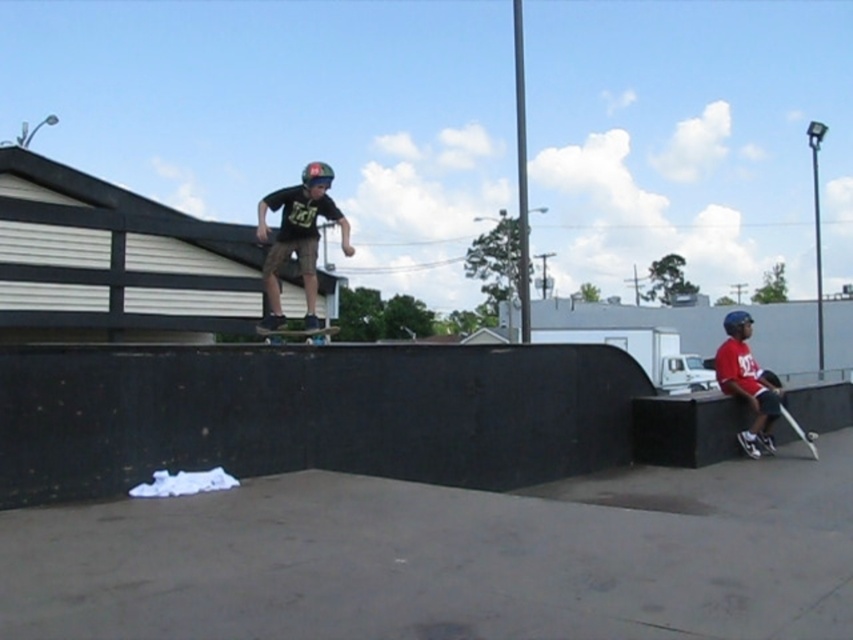
You are a photographer at the skatepark and want to capture a photo of the red cotton shirt at right and the black matte skateboard at center. Which object should you zoom in on to ensure both are clearly visible in the frame?

The red cotton shirt at right is wider than the black matte skateboard at center, so you should zoom in on the red cotton shirt at right to ensure both fit clearly in the frame.

You are a photographer at the skatepark and want to capture a photo of the red cotton shirt at right and the black matte skateboard at center. Which object should you focus on first if you want to ensure both are in sharp focus?

The red cotton shirt at right is located below the black matte skateboard at center, so focusing on the black matte skateboard at center first would ensure both are in sharp focus since it is closer to the camera.